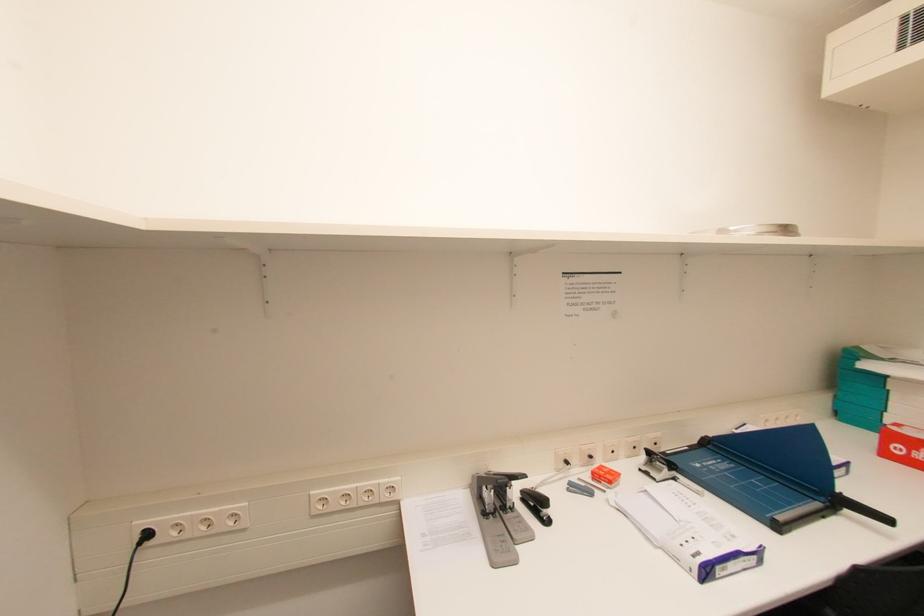
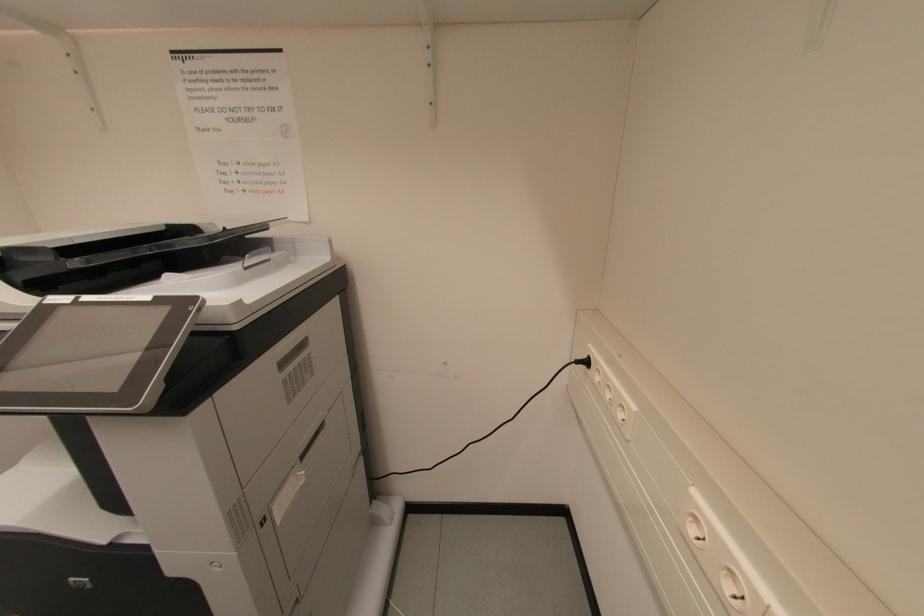
The first image is from the beginning of the video and the second image is from the end. How did the camera likely rotate when shooting the video?

The camera's rotation is toward left-down.